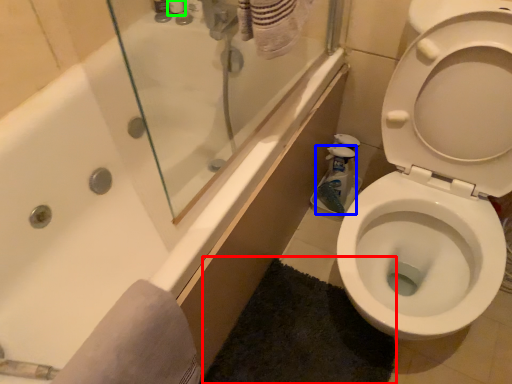
Question: Which is nearer to the bath mat (highlighted by a red box)? cleaning product (highlighted by a blue box) or toiletry (highlighted by a green box).

Choices:
 (A) cleaning product
 (B) toiletry

Answer: (A)